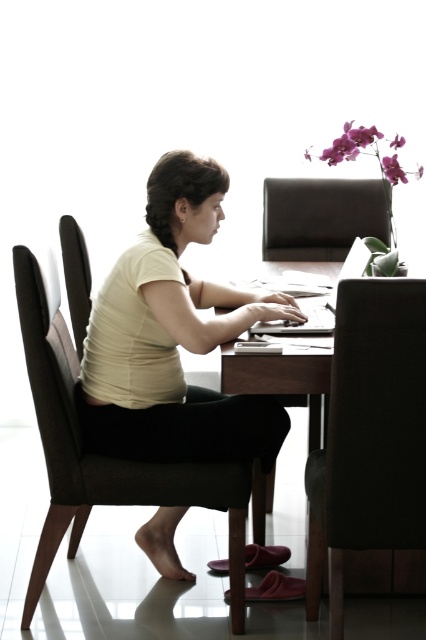
Question: Can you confirm if brown leather chair at center is smaller than brown fabric chair at center?

Choices:
 (A) no
 (B) yes

Answer: (B)

Question: Observing the image, what is the correct spatial positioning of matte yellow shirt at center in reference to brown fabric chair at center?

Choices:
 (A) above
 (B) below

Answer: (A)

Question: Which of these objects is positioned closest to the dark brown leather chair at left?

Choices:
 (A) brown leather chair at center
 (B) brown fabric chair at center
 (C) dark brown leather chair at center
 (D) silver metallic laptop at center

Answer: (B)

Question: Is dark brown leather chair at left bigger than silver metallic laptop at center?

Choices:
 (A) no
 (B) yes

Answer: (A)

Question: Which point is closer to the camera taking this photo?

Choices:
 (A) (60, 394)
 (B) (334, 289)
 (C) (317, 196)

Answer: (A)

Question: Which object appears farthest from the camera in this image?

Choices:
 (A) dark brown leather chair at left
 (B) silver metallic laptop at center
 (C) brown fabric chair at center

Answer: (A)